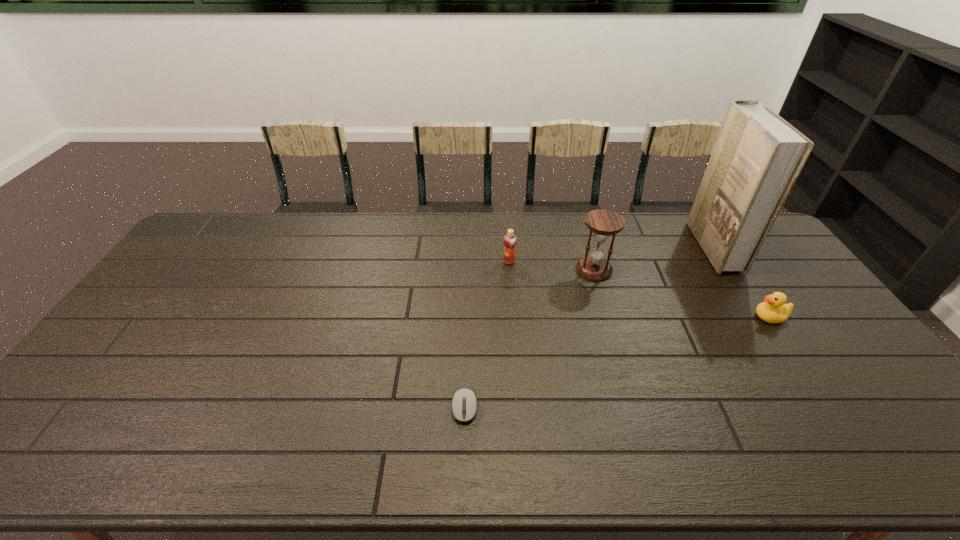
In order to click on vacant space located on the cover of the tallest object in this screenshot , I will do `click(604, 247)`.

Find the location of a particular element. The image size is (960, 540). free point located on the cover of the tallest object is located at coordinates (617, 247).

The height and width of the screenshot is (540, 960). Find the location of `vacant space located 0.200m on the back of the hourglass`. vacant space located 0.200m on the back of the hourglass is located at coordinates (581, 225).

Locate an element on the screen. This screenshot has width=960, height=540. vacant space located on the front of the orange juice is located at coordinates click(x=511, y=284).

The width and height of the screenshot is (960, 540). I want to click on free point located 0.080m at the beak of the duck, so click(728, 317).

Locate an element on the screen. The image size is (960, 540). vacant position located 0.360m at the beak of the duck is located at coordinates (635, 317).

Image resolution: width=960 pixels, height=540 pixels. I want to click on free region located 0.110m at the beak of the duck, so click(718, 317).

This screenshot has width=960, height=540. I want to click on free space located 0.060m on the wheel side of the shortest object, so click(464, 448).

This screenshot has width=960, height=540. I want to click on object situated at the far edge, so [757, 157].

Locate an element on the screen. phonebook that is at the right edge is located at coordinates (757, 157).